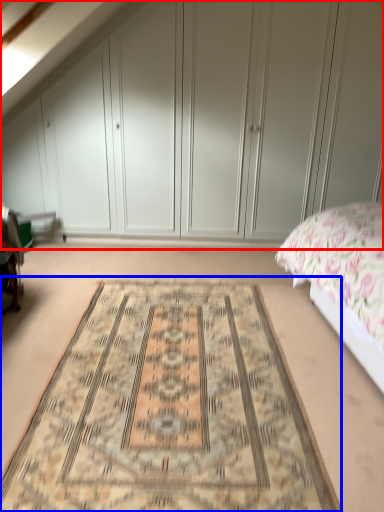
Question: Which of the following is the farthest to the observer, dresser (highlighted by a red box) or mat (highlighted by a blue box)?

Choices:
 (A) dresser
 (B) mat

Answer: (A)